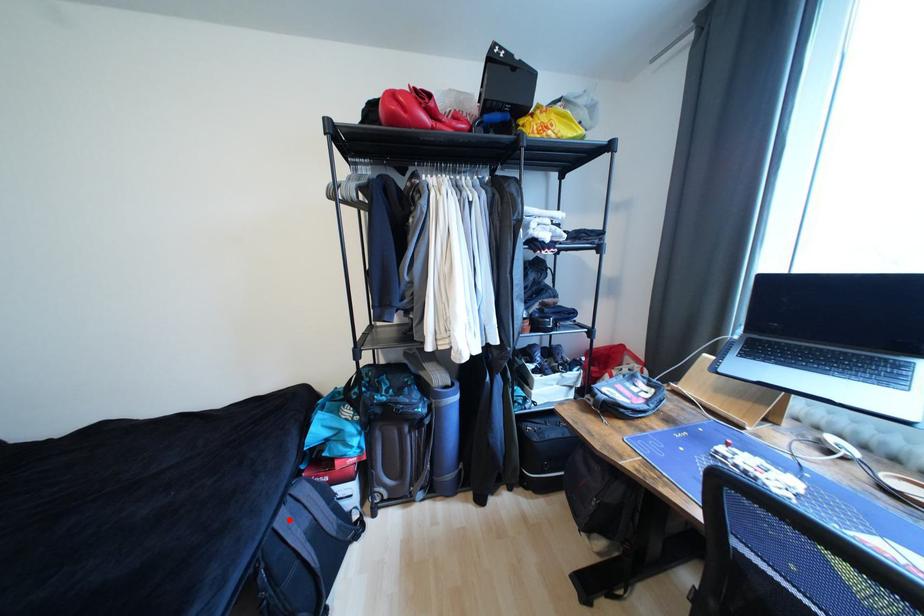
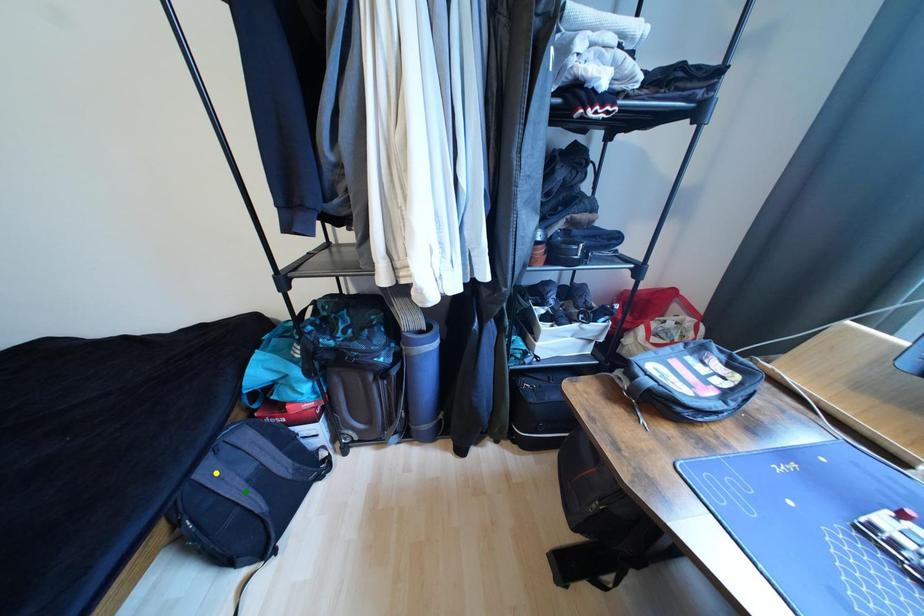
Question: I am providing you with two images of the same scene from different viewpoints. A red point is marked on the first image. You are given multiple points on the second image. In image 2, which mark is for the same physical point as the one in image 1?

Choices:
 (A) blue point
 (B) green point
 (C) yellow point

Answer: (C)